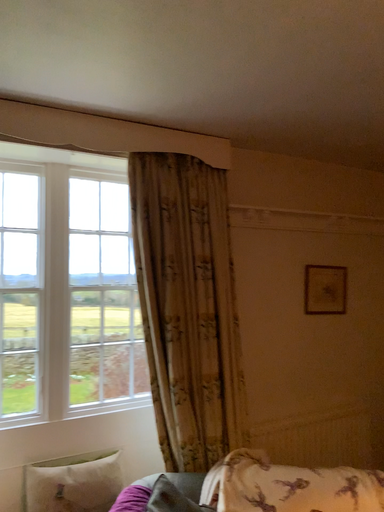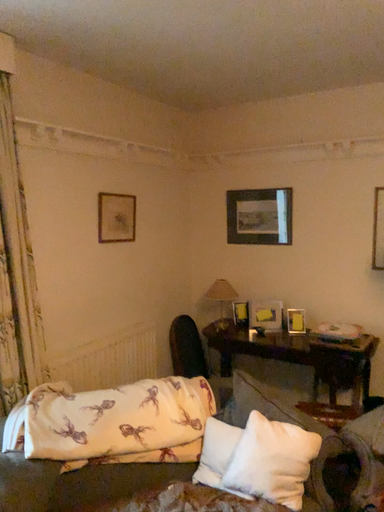
Question: How did the camera likely rotate when shooting the video?

Choices:
 (A) rotated upward
 (B) rotated downward

Answer: (B)